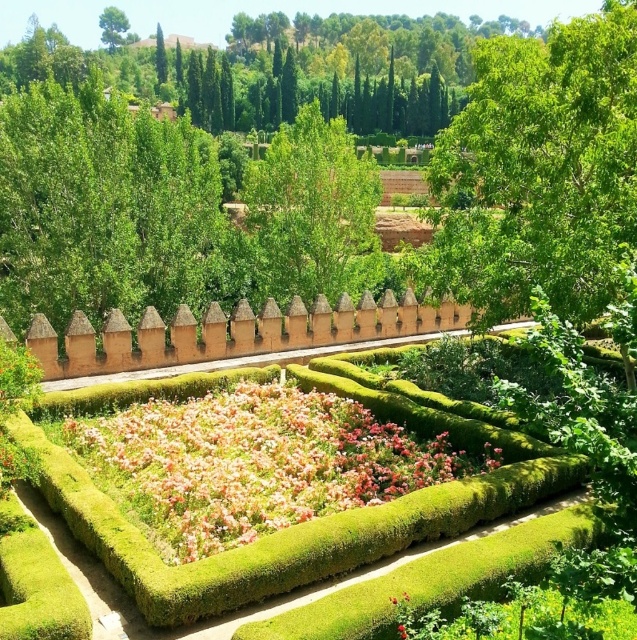
Between green mossy hedge at center and green leafy tree at upper center, which one has more height?

green leafy tree at upper center is taller.

Where is `green mossy hedge at center`? Image resolution: width=637 pixels, height=640 pixels. green mossy hedge at center is located at coordinates (308, 522).

Describe the element at coordinates (308, 522) in the screenshot. I see `green mossy hedge at center` at that location.

Identify the location of green mossy hedge at center. (308, 522).

Between green leafy tree at upper right and pink soft-textured flowers at center, which one has less height?

pink soft-textured flowers at center

Is point (447, 246) positioned behind point (208, 467)?

Yes, it is.

I want to click on green leafy tree at upper right, so click(538, 172).

Does pink soft-textured flowers at center appear under green leafy tree at upper center?

Yes.

Is pink soft-textured flowers at center further to the viewer compared to green leafy tree at upper center?

No, pink soft-textured flowers at center is in front of green leafy tree at upper center.

Where is `pink soft-textured flowers at center`? pink soft-textured flowers at center is located at coordinates (248, 461).

This screenshot has height=640, width=637. Identify the location of pink soft-textured flowers at center. (248, 461).